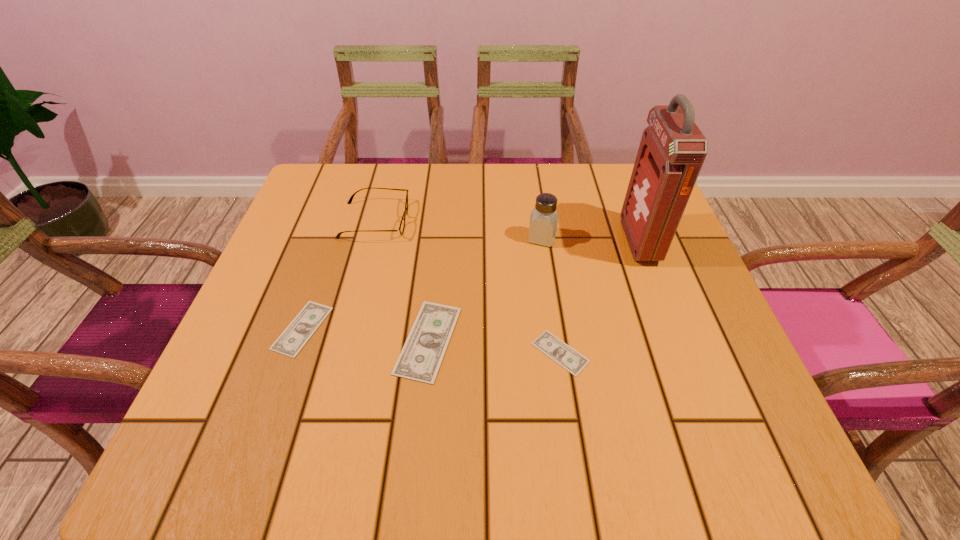
The width and height of the screenshot is (960, 540). I want to click on vacant position located 0.340m on the right of the leftmost money, so click(505, 328).

Where is `free location located on the right of the second money from left to right`? This screenshot has width=960, height=540. free location located on the right of the second money from left to right is located at coordinates (519, 340).

Where is `vacant space situated on the back of the shortest object`? This screenshot has height=540, width=960. vacant space situated on the back of the shortest object is located at coordinates (539, 208).

Image resolution: width=960 pixels, height=540 pixels. In order to click on vacant region located 0.290m on the front-facing side of the spectacles in this screenshot , I will do `click(528, 220)`.

Locate an element on the screen. This screenshot has width=960, height=540. vacant space located 0.140m on the left of the saltshaker is located at coordinates (467, 238).

This screenshot has width=960, height=540. I want to click on blank space located 0.220m on the front-facing side of the tallest object, so click(x=531, y=242).

This screenshot has width=960, height=540. In order to click on free space located 0.200m on the front-facing side of the tallest object in this screenshot , I will do `click(540, 242)`.

Locate an element on the screen. This screenshot has height=540, width=960. free spot located 0.140m on the front-facing side of the tallest object is located at coordinates pyautogui.click(x=565, y=242).

You are a GUI agent. You are given a task and a screenshot of the screen. Output one action in this format:
    pyautogui.click(x=<x>, y=<y>)
    Task: Click on the object present at the far edge
    This screenshot has height=540, width=960.
    Given the screenshot: What is the action you would take?
    pyautogui.click(x=402, y=225)

Identify the location of money that is at the left edge. The height and width of the screenshot is (540, 960). (300, 330).